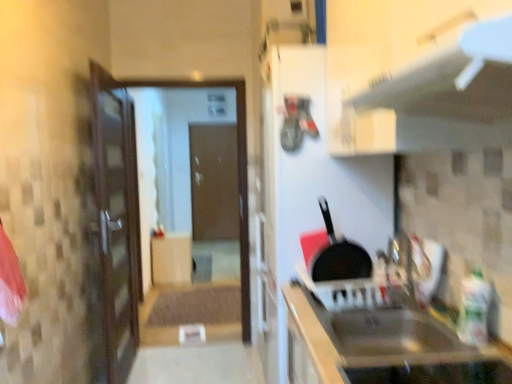
Question: Is transparent glass door at center wider or thinner than black matte frying pan at center?

Choices:
 (A) thin
 (B) wide

Answer: (B)

Question: From a real-world perspective, relative to black matte frying pan at center, is transparent glass door at center vertically above or below?

Choices:
 (A) above
 (B) below

Answer: (B)

Question: Based on their relative distances, which object is nearer to the brown matte door at center?

Choices:
 (A) black matte frying pan at center
 (B) metallic gray exhaust hood at upper center
 (C) matte wood cabinet at center, marked as the 1th cabinetry in a left-to-right arrangement
 (D) metallic stainless steel sink at lower right, which appears as the first cabinetry when viewed from the right
 (E) transparent glass door at center

Answer: (E)

Question: Based on their relative distances, which object is nearer to the matte wood cabinet at center, the 1th cabinetry positioned from the back?

Choices:
 (A) metallic gray exhaust hood at upper center
 (B) metallic stainless steel sink at lower right, which appears as the first cabinetry when viewed from the right
 (C) black matte frying pan at center
 (D) transparent glass door at center
 (E) brown matte door at center

Answer: (D)